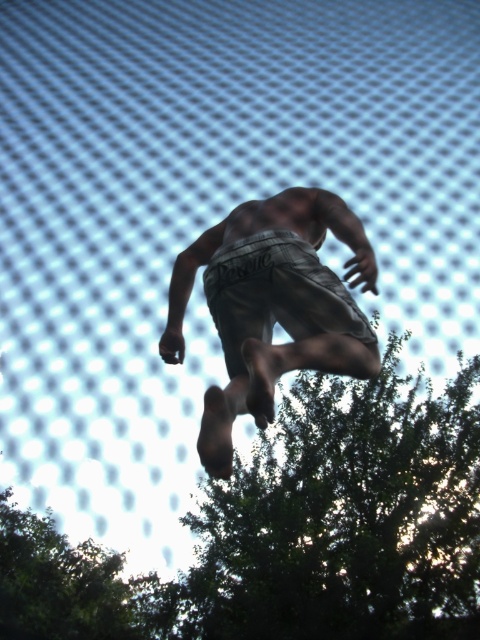
Question: Which object appears closest to the camera in this image?

Choices:
 (A) gray cotton shorts at center
 (B) green leafy tree at lower right

Answer: (A)

Question: Which of the following is the closest to the observer?

Choices:
 (A) gray cotton shorts at center
 (B) green leafy tree at lower right

Answer: (A)

Question: Is green leafy tree at lower right to the left of gray cotton shorts at center from the viewer's perspective?

Choices:
 (A) yes
 (B) no

Answer: (B)

Question: Which of the following is the farthest from the observer?

Choices:
 (A) green leafy tree at lower right
 (B) gray cotton shorts at center

Answer: (A)

Question: Is green leafy tree at lower right to the right of gray cotton shorts at center from the viewer's perspective?

Choices:
 (A) no
 (B) yes

Answer: (B)

Question: Does green leafy tree at lower right have a lesser width compared to gray cotton shorts at center?

Choices:
 (A) yes
 (B) no

Answer: (A)